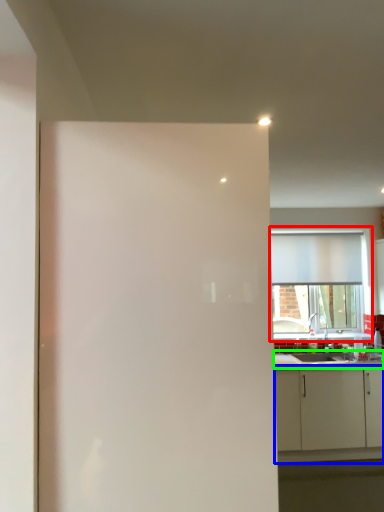
Question: Considering the real-world distances, which object is farthest from window (highlighted by a red box)? cabinetry (highlighted by a blue box) or countertop (highlighted by a green box)?

Choices:
 (A) cabinetry
 (B) countertop

Answer: (A)